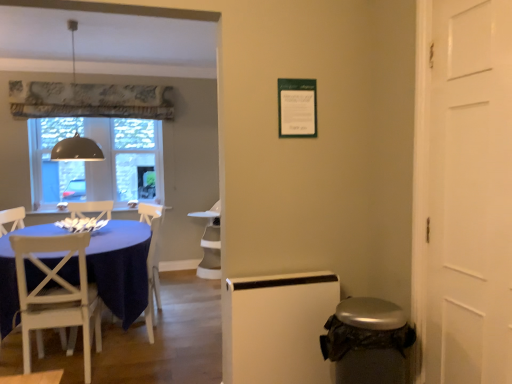
Question: Is matte gray dome at upper left in contact with clear glass window at center?

Choices:
 (A) no
 (B) yes

Answer: (A)

Question: Is matte gray dome at upper left positioned behind clear glass window at center?

Choices:
 (A) yes
 (B) no

Answer: (B)

Question: Is matte gray dome at upper left bigger than clear glass window at center?

Choices:
 (A) yes
 (B) no

Answer: (A)

Question: Is matte gray dome at upper left taller than clear glass window at center?

Choices:
 (A) yes
 (B) no

Answer: (A)

Question: From a real-world perspective, is matte gray dome at upper left over clear glass window at center?

Choices:
 (A) no
 (B) yes

Answer: (B)

Question: From the image's perspective, is matte gray dome at upper left positioned above or below white glossy armchair at center, which ranks as the 1th armchair in back-to-front order?

Choices:
 (A) above
 (B) below

Answer: (A)

Question: Is matte gray dome at upper left spatially inside white glossy armchair at center, which ranks as the second armchair in front-to-back order, or outside of it?

Choices:
 (A) outside
 (B) inside

Answer: (A)

Question: In terms of width, does matte gray dome at upper left look wider or thinner when compared to white glossy armchair at center, which ranks as the 1th armchair in back-to-front order?

Choices:
 (A) wide
 (B) thin

Answer: (B)

Question: In the image, is matte gray dome at upper left positioned in front of or behind white glossy armchair at center, which ranks as the 1th armchair in back-to-front order?

Choices:
 (A) behind
 (B) front

Answer: (B)

Question: Visually, is white wood chair at left positioned to the left or to the right of white wood chair at left, which ranks as the second armchair in back-to-front order?

Choices:
 (A) right
 (B) left

Answer: (B)

Question: From a real-world perspective, is white wood chair at left positioned above or below white wood chair at left, which ranks as the second armchair in back-to-front order?

Choices:
 (A) above
 (B) below

Answer: (A)

Question: Is point (17, 246) closer or farther from the camera than point (147, 271)?

Choices:
 (A) closer
 (B) farther

Answer: (A)

Question: Considering the positions of white wood chair at left and white wood chair at left, which ranks as the second armchair in back-to-front order, in the image, is white wood chair at left wider or thinner than white wood chair at left, which ranks as the second armchair in back-to-front order,?

Choices:
 (A) wide
 (B) thin

Answer: (A)

Question: From their relative heights in the image, would you say white wood chair at left is taller or shorter than white glossy armchair at center, which ranks as the second armchair in front-to-back order?

Choices:
 (A) tall
 (B) short

Answer: (B)

Question: From the image's perspective, is white wood chair at left above or below white glossy armchair at center, which ranks as the second armchair in front-to-back order?

Choices:
 (A) below
 (B) above

Answer: (A)